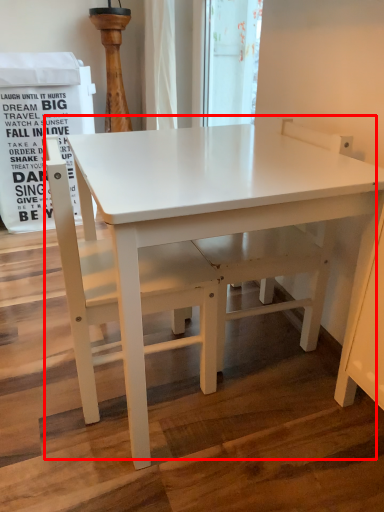
Question: From the image, what is the correct spatial relationship of table (annotated by the red box) in relation to chair?

Choices:
 (A) left
 (B) right

Answer: (B)